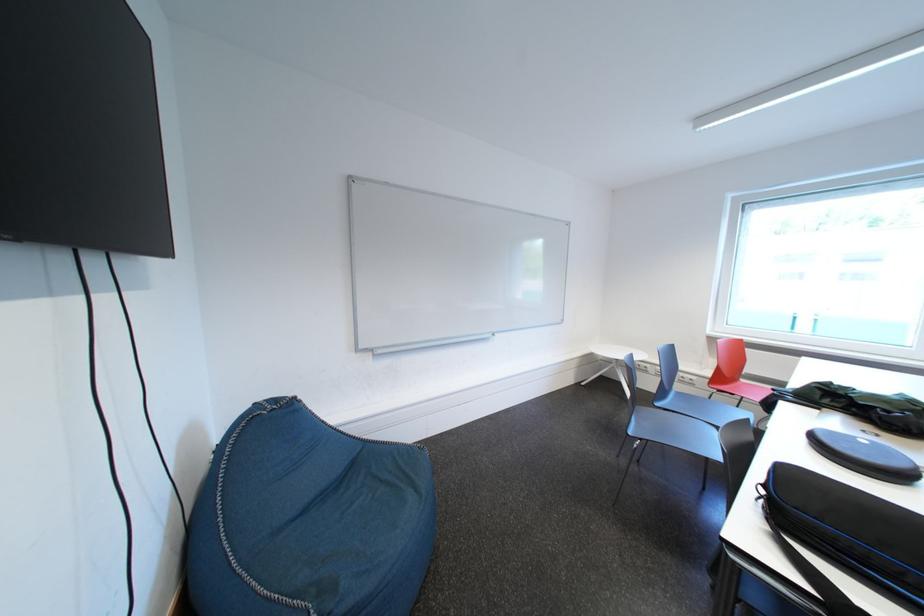
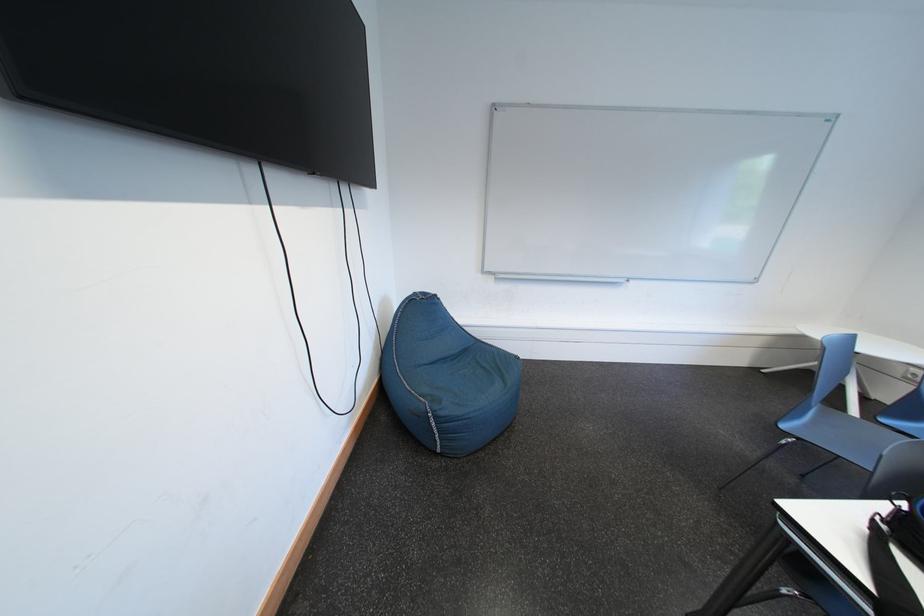
Question: The first image is from the beginning of the video and the second image is from the end. How did the camera likely rotate when shooting the video?

Choices:
 (A) Left
 (B) Right
 (C) Up
 (D) Down

Answer: (A)